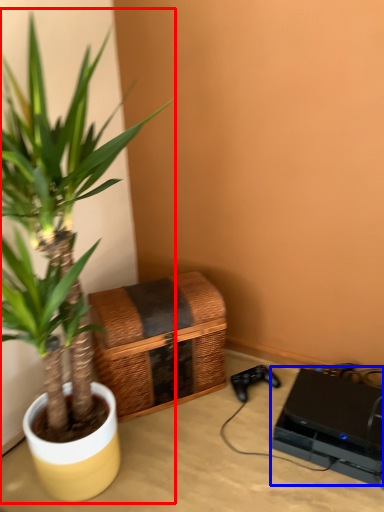
Question: Which object appears farthest to the camera in this image, houseplant (highlighted by a red box) or computer (highlighted by a blue box)?

Choices:
 (A) houseplant
 (B) computer

Answer: (B)